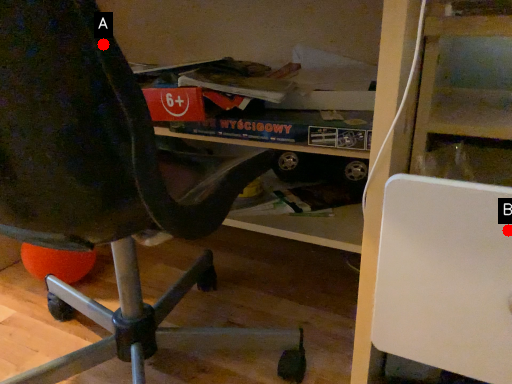
Question: Two points are circled on the image, labeled by A and B beside each circle. Which point is closer to the camera taking this photo?

Choices:
 (A) A is closer
 (B) B is closer

Answer: (A)